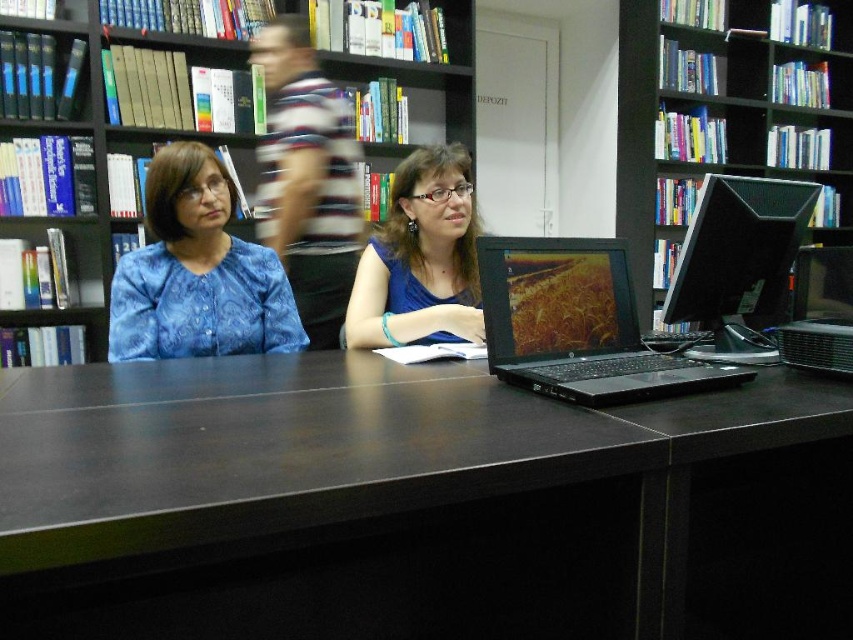
You are a photographer taking a portrait of the striped fabric shirt at upper center and the black glossy monitor at right. Which object should you focus on if you want to capture the wider subject?

The striped fabric shirt at upper center is wider than the black glossy monitor at right, so you should focus on the striped fabric shirt at upper center to capture the wider subject.

You are a photographer taking a picture of the striped fabric shirt at upper center and the black glossy monitor at right. Which object should you focus on first if you want to capture both in sharp focus?

The striped fabric shirt at upper center should be focused on first because it is located above the black glossy monitor at right, so adjusting focus starting from the higher object ensures both are in sharp focus.